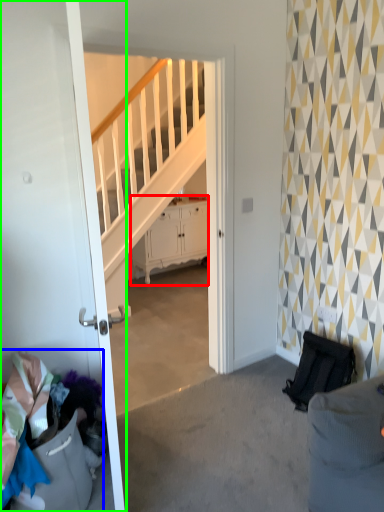
Question: Which object is the closest to the cabinetry (highlighted by a red box)? Choose among these: laundry (highlighted by a blue box) or door (highlighted by a green box).

Choices:
 (A) laundry
 (B) door

Answer: (B)